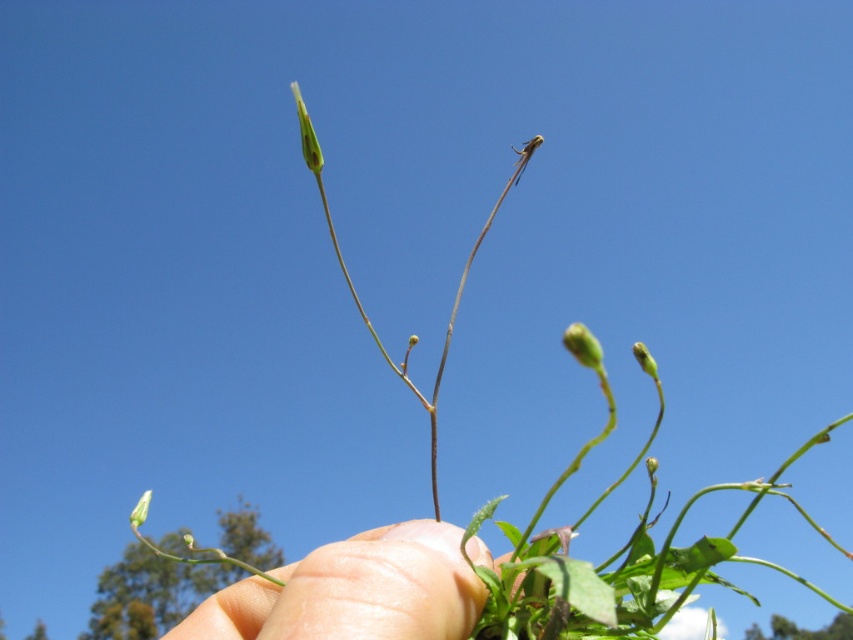
Between green matte bud at upper center and green matte flower at lower left, which one has less height?

Standing shorter between the two is green matte bud at upper center.

Is point (636, 340) more distant than point (142, 500)?

No, (636, 340) is closer to viewer.

At what (x,y) coordinates should I click in order to perform the action: click on green matte bud at upper center. Please return your answer as a coordinate pair (x, y). This screenshot has height=640, width=853. Looking at the image, I should click on (x=643, y=358).

Is point (589, 346) positioned behind point (643, 349)?

No.

Which of these two, green matte bud at center or green matte bud at upper center, stands shorter?

Standing shorter between the two is green matte bud at center.

The height and width of the screenshot is (640, 853). Find the location of `green matte bud at center`. green matte bud at center is located at coordinates (582, 346).

You are a GUI agent. You are given a task and a screenshot of the screen. Output one action in this format:
    pyautogui.click(x=<x>, y=<y>)
    Task: Click on the green matte bud at center
    
    Given the screenshot: What is the action you would take?
    pyautogui.click(x=582, y=346)

Does flesh/soft skin at center appear on the right side of green matte bud at center?

Incorrect, flesh/soft skin at center is not on the right side of green matte bud at center.

Between flesh/soft skin at center and green matte bud at center, which one has more height?

Standing taller between the two is flesh/soft skin at center.

Does point (334, 547) come behind point (576, 346)?

That is True.

The image size is (853, 640). Find the location of `flesh/soft skin at center`. flesh/soft skin at center is located at coordinates (352, 592).